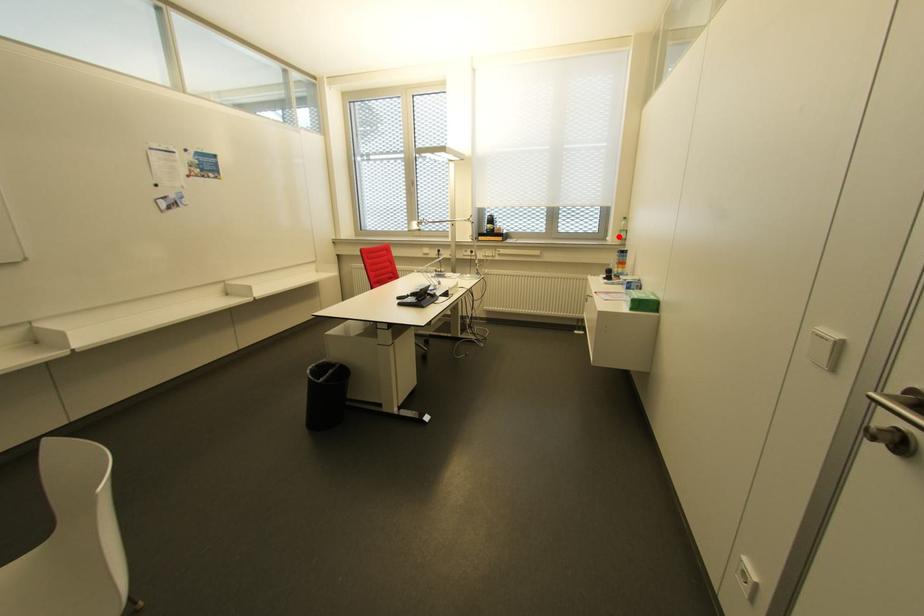
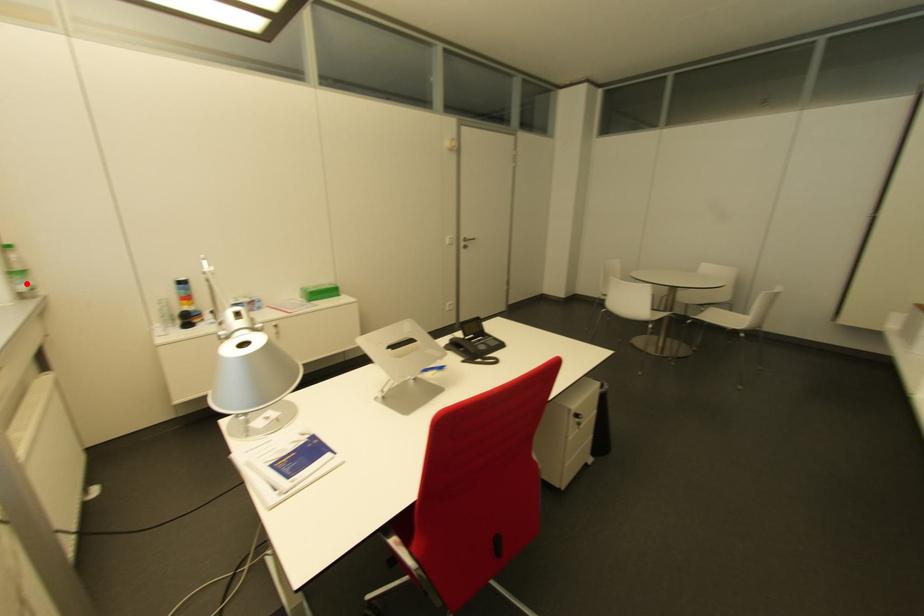
I am providing you with two images of the same scene from different viewpoints. A red point is marked on the first image and another point is marked on the second image. Is the marked point in image1 the same physical position as the marked point in image2?

Yes